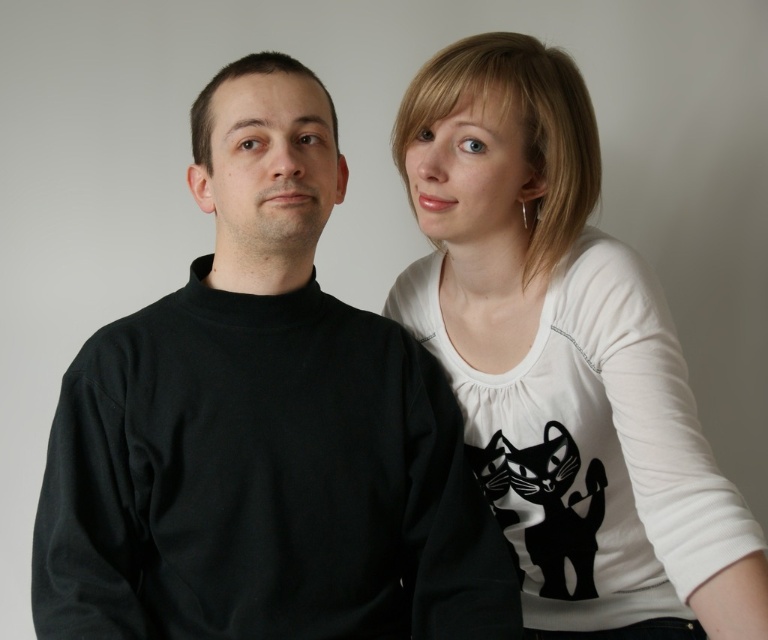
You are a photographer setting up a photo shoot. You have a 1.2 meter wide backdrop that needs to accommodate both the black matte turtleneck sweater at left and the white matte shirt at upper right. Based on the image, which of the two items is wider and would require more space on the backdrop?

The black matte turtleneck sweater at left is wider than the white matte shirt at upper right, so it would require more space on the backdrop.

You are an AI analyzing the spatial layout of a photograph. In the image provided, where is the black matte turtleneck sweater at left located in terms of its 2D coordinates?

The black matte turtleneck sweater at left is located at the 2D coordinates point (262, 428).

You are a photographer setting up for a portrait session. You need to adjust the lighting so that the black matte turtleneck sweater at left and the white matte shirt at upper right are both well illuminated. Considering their sizes, which object requires a larger light source to achieve proper exposure?

The black matte turtleneck sweater at left has a lesser height compared to the white matte shirt at upper right, so the white matte shirt at upper right requires a larger light source to achieve proper exposure due to its greater size.